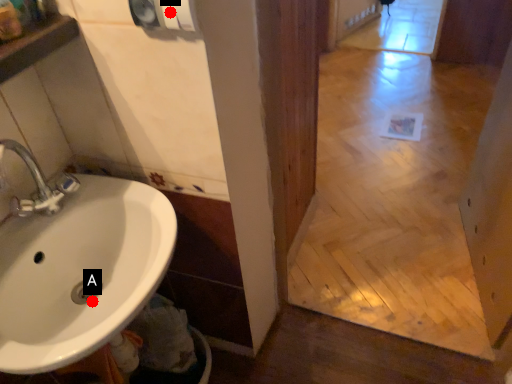
Question: Two points are circled on the image, labeled by A and B beside each circle. Which point is farther to the camera?

Choices:
 (A) A is further
 (B) B is further

Answer: (A)